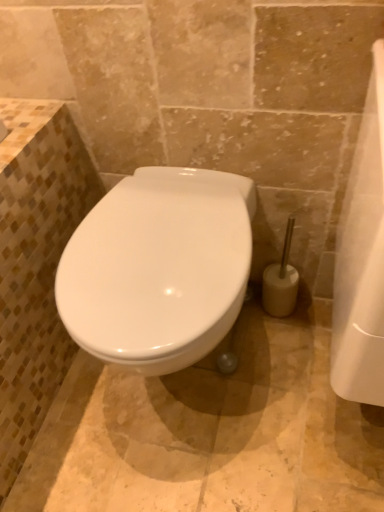
This screenshot has height=512, width=384. I want to click on blank space situated above white glossy toilet at center (from a real-world perspective), so click(x=156, y=237).